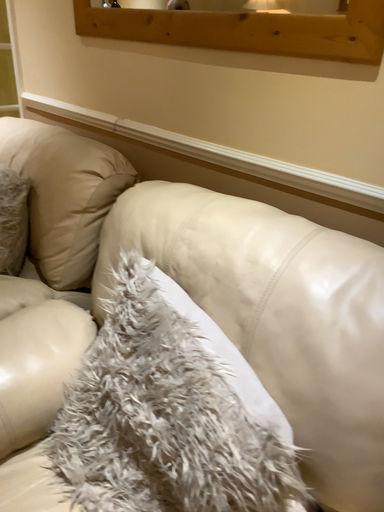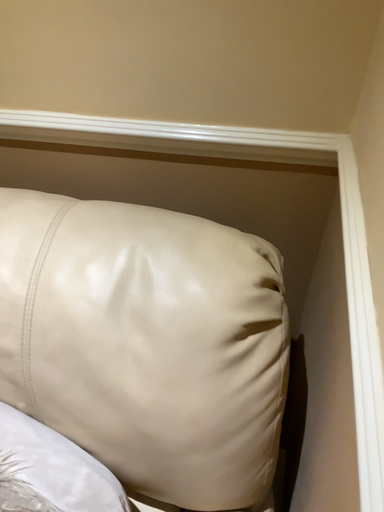
Question: Which way did the camera rotate in the video?

Choices:
 (A) rotated downward
 (B) rotated upward

Answer: (A)